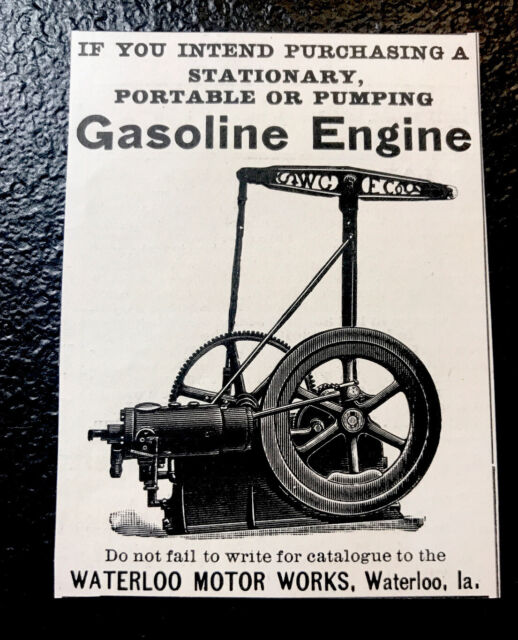
Where is `black popcorn styled wall`? black popcorn styled wall is located at coordinates (41, 178), (501, 339).